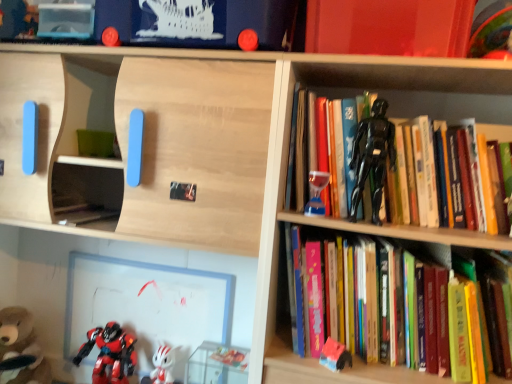
Question: Should I look upward or downward to see shiny red plastic robot at lower left, which appears as the fifth toy when viewed from the right?

Choices:
 (A) down
 (B) up

Answer: (A)

Question: Can you confirm if brown plush bear at lower left, which appears as the 1th toy when viewed from the left, is shorter than black plastic action figure at upper right?

Choices:
 (A) yes
 (B) no

Answer: (A)

Question: From a real-world perspective, is brown plush bear at lower left, marked as the sixth toy in a right-to-left arrangement, on top of black plastic action figure at upper right?

Choices:
 (A) yes
 (B) no

Answer: (B)

Question: Are brown plush bear at lower left, which appears as the 1th toy when viewed from the left, and black plastic action figure at upper right making contact?

Choices:
 (A) yes
 (B) no

Answer: (B)

Question: Does brown plush bear at lower left, marked as the sixth toy in a right-to-left arrangement, lie behind black plastic action figure at upper right?

Choices:
 (A) yes
 (B) no

Answer: (A)

Question: From the image's perspective, is brown plush bear at lower left, which appears as the 1th toy when viewed from the left, under black plastic action figure at upper right?

Choices:
 (A) no
 (B) yes

Answer: (B)

Question: Is brown plush bear at lower left, marked as the sixth toy in a right-to-left arrangement, oriented towards black plastic action figure at upper right?

Choices:
 (A) yes
 (B) no

Answer: (B)

Question: Is black glossy action figure at upper right, which is the 2th book from bottom to top, facing towards rubberized plastic toy at lower right, the 5th toy when ordered from left to right?

Choices:
 (A) yes
 (B) no

Answer: (B)

Question: From the image's perspective, is black glossy action figure at upper right, which is the 1th book in top-to-bottom order, beneath rubberized plastic toy at lower right, the 5th toy when ordered from left to right?

Choices:
 (A) no
 (B) yes

Answer: (A)

Question: From a real-world perspective, is black glossy action figure at upper right, which is the 2th book from bottom to top, physically below rubberized plastic toy at lower right, the 5th toy when ordered from left to right?

Choices:
 (A) yes
 (B) no

Answer: (B)

Question: Is rubberized plastic toy at lower right, which ranks as the second toy in right-to-left order, surrounded by black glossy action figure at upper right, which is the 2th book from bottom to top?

Choices:
 (A) no
 (B) yes

Answer: (A)

Question: Can you confirm if black glossy action figure at upper right, which is the 2th book from bottom to top, is bigger than rubberized plastic toy at lower right, the 5th toy when ordered from left to right?

Choices:
 (A) yes
 (B) no

Answer: (A)

Question: Is black glossy action figure at upper right, which is the 2th book from bottom to top, positioned with its back to rubberized plastic toy at lower right, which ranks as the second toy in right-to-left order?

Choices:
 (A) yes
 (B) no

Answer: (B)

Question: Can wooden shelf at upper center, positioned as the 2th shelf in back-to-front order, be found inside white glossy figurine at lower center, acting as the fourth toy starting from the right?

Choices:
 (A) no
 (B) yes

Answer: (A)